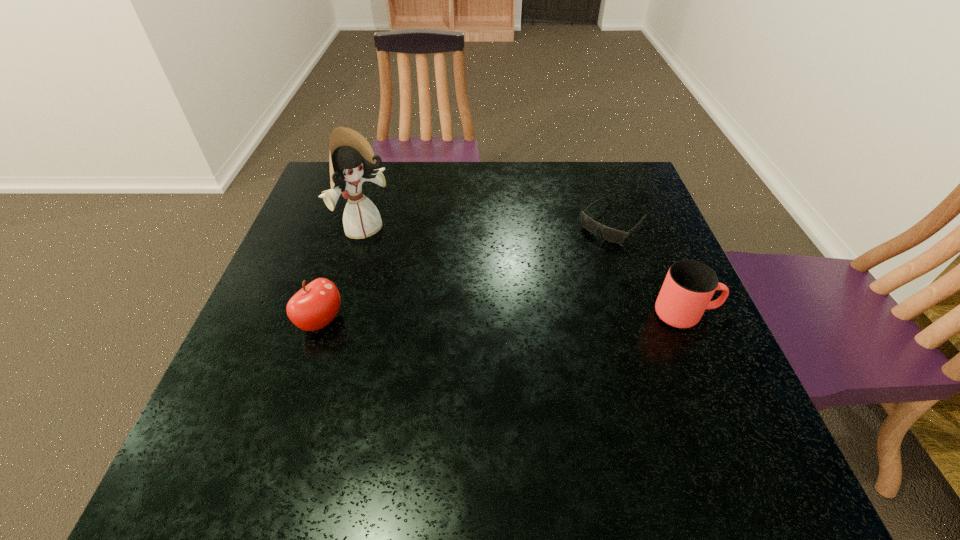
This screenshot has height=540, width=960. Find the location of `vacant spot on the desktop that is between the apple and the cup and is positioned at the front face of the tallest object`. vacant spot on the desktop that is between the apple and the cup and is positioned at the front face of the tallest object is located at coordinates (470, 318).

Image resolution: width=960 pixels, height=540 pixels. Find the location of `free space on the desktop that is between the apple and the cup and is positioned on the front-facing side of the shortest object`. free space on the desktop that is between the apple and the cup and is positioned on the front-facing side of the shortest object is located at coordinates (510, 318).